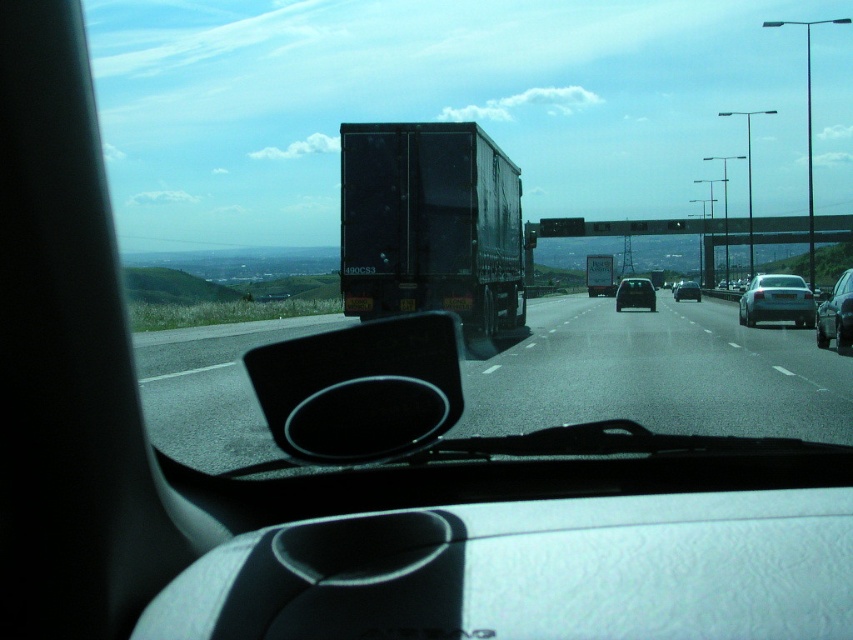
Question: Can you confirm if black matte view mirror at center is bigger than silver metallic sedan at right?

Choices:
 (A) no
 (B) yes

Answer: (A)

Question: Is black matte trailer truck at center bigger than black matte view mirror at center?

Choices:
 (A) no
 (B) yes

Answer: (B)

Question: Where is matte black car at center located in relation to shiny silver sedan at center in the image?

Choices:
 (A) below
 (B) above

Answer: (B)

Question: Among these objects, which one is farthest from the camera?

Choices:
 (A) black matte trailer truck at center
 (B) shiny silver sedan at right
 (C) shiny silver sedan at center
 (D) black matte view mirror at center

Answer: (C)

Question: Among these points, which one is nearest to the camera?

Choices:
 (A) (357, 365)
 (B) (618, 291)
 (C) (514, 420)

Answer: (C)

Question: Which object is positioned farthest from the shiny silver sedan at right?

Choices:
 (A) silver metallic sedan at right
 (B) black rubber road at center

Answer: (B)